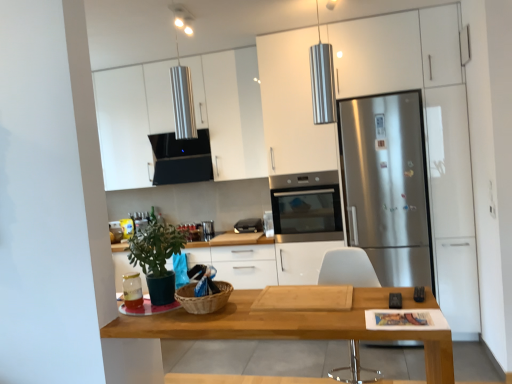
Locate an element on the screen. free space to the left of woven brown basket at center is located at coordinates (153, 311).